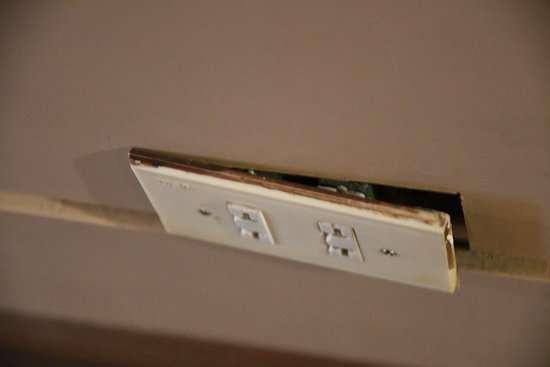
Locate an element on the screen. This screenshot has height=367, width=550. top of baseboard is located at coordinates (74, 209), (510, 267).